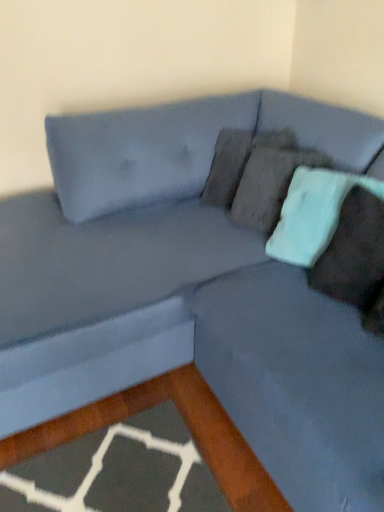
Question: Considering their positions, is teal fabric pillow at upper right, which ranks as the first pillow in back-to-front order, located in front of or behind teal fabric pillow at right, placed as the 1th pillow when sorted from front to back?

Choices:
 (A) behind
 (B) front

Answer: (A)

Question: Would you say teal fabric pillow at upper right, which ranks as the first pillow in back-to-front order, is inside or outside teal fabric pillow at right, the 2th pillow from the back?

Choices:
 (A) outside
 (B) inside

Answer: (A)

Question: In terms of height, does teal fabric pillow at upper right, which ranks as the first pillow in back-to-front order, look taller or shorter compared to teal fabric pillow at right, the 2th pillow from the back?

Choices:
 (A) short
 (B) tall

Answer: (B)

Question: Is point (375, 202) closer or farther from the camera than point (329, 238)?

Choices:
 (A) farther
 (B) closer

Answer: (B)

Question: From their relative heights in the image, would you say teal fabric pillow at right, placed as the 1th pillow when sorted from front to back, is taller or shorter than teal fabric pillow at upper right, which ranks as the first pillow in back-to-front order?

Choices:
 (A) short
 (B) tall

Answer: (A)

Question: Considering their positions, is teal fabric pillow at right, the 2th pillow from the back, located in front of or behind teal fabric pillow at upper right, the second pillow viewed from the front?

Choices:
 (A) behind
 (B) front

Answer: (B)

Question: Is teal fabric pillow at right, placed as the 1th pillow when sorted from front to back, situated inside teal fabric pillow at upper right, which ranks as the first pillow in back-to-front order, or outside?

Choices:
 (A) inside
 (B) outside

Answer: (A)